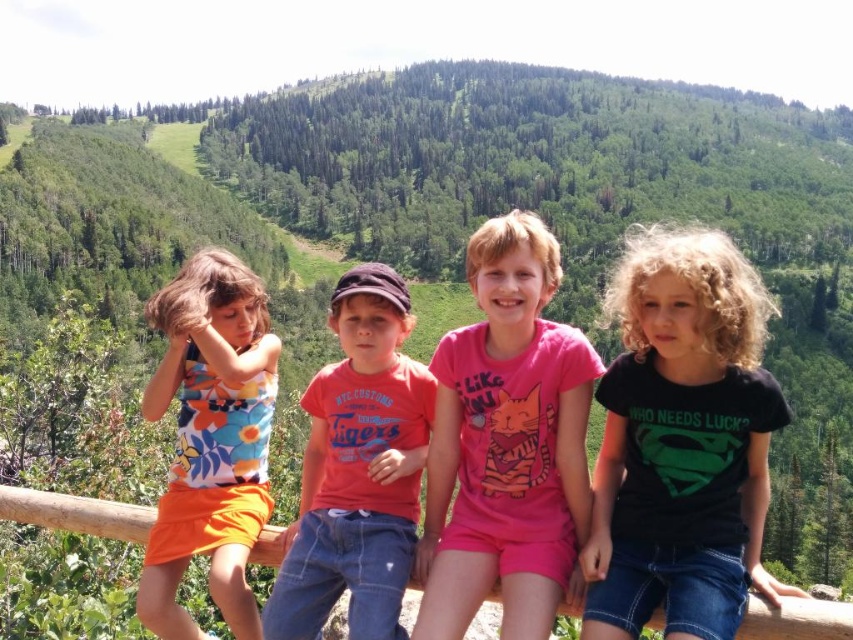
Does black cotton shirt at center have a greater height compared to floral fabric dress at left?

Yes, black cotton shirt at center is taller than floral fabric dress at left.

Describe the element at coordinates (682, 442) in the screenshot. The image size is (853, 640). I see `black cotton shirt at center` at that location.

Where is `black cotton shirt at center`? Image resolution: width=853 pixels, height=640 pixels. black cotton shirt at center is located at coordinates (682, 442).

Who is positioned more to the right, black cotton shirt at center or matte orange t-shirt at center?

Positioned to the right is black cotton shirt at center.

Is black cotton shirt at center wider than matte orange t-shirt at center?

Yes, black cotton shirt at center is wider than matte orange t-shirt at center.

Is point (631, 531) farther from camera compared to point (354, 266)?

No.

Find the location of `black cotton shirt at center`. black cotton shirt at center is located at coordinates (682, 442).

Who is higher up, matte orange t-shirt at center or floral fabric dress at left?

floral fabric dress at left is higher up.

Which is behind, point (297, 588) or point (187, 413)?

The point (187, 413) is more distant.

The image size is (853, 640). Find the location of `matte orange t-shirt at center`. matte orange t-shirt at center is located at coordinates (357, 468).